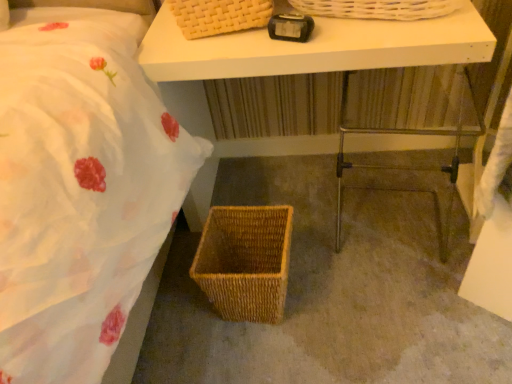
I want to click on vacant space in front of metallic silver step stool at lower right, so click(405, 304).